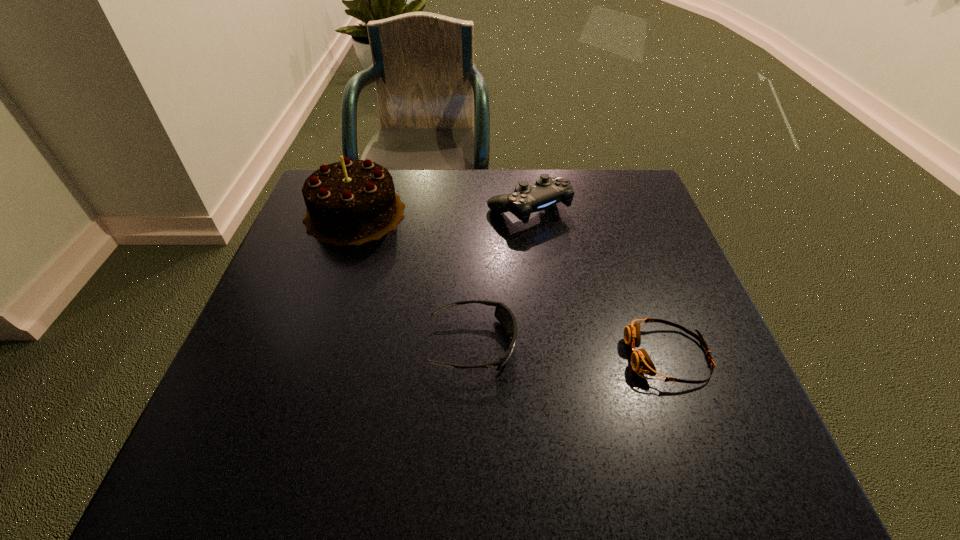
Find the location of `blank space located with the lenses facing forward on the shortest object`. blank space located with the lenses facing forward on the shortest object is located at coordinates coord(542,356).

Locate an element on the screen. Image resolution: width=960 pixels, height=540 pixels. free space located 0.080m with the lenses facing forward on the shortest object is located at coordinates (585, 356).

You are a GUI agent. You are given a task and a screenshot of the screen. Output one action in this format:
    pyautogui.click(x=<x>, y=<y>)
    Task: Click on the birthday cake located in the far edge section of the desktop
    The height and width of the screenshot is (540, 960).
    Given the screenshot: What is the action you would take?
    pos(351,202)

Locate an element on the screen. control at the far edge is located at coordinates coord(547,191).

I want to click on object positioned at the left edge, so click(x=351, y=202).

Where is `object that is at the right edge`? object that is at the right edge is located at coordinates (641, 362).

Locate an element on the screen. The width and height of the screenshot is (960, 540). object located at the far left corner is located at coordinates (351, 202).

Where is `free space at the far edge of the desktop`? The image size is (960, 540). free space at the far edge of the desktop is located at coordinates click(404, 203).

Find the location of a particular element. The width and height of the screenshot is (960, 540). vacant point at the near edge is located at coordinates (592, 441).

Find the location of a particular element. This screenshot has width=960, height=540. free space at the left edge of the desktop is located at coordinates (281, 427).